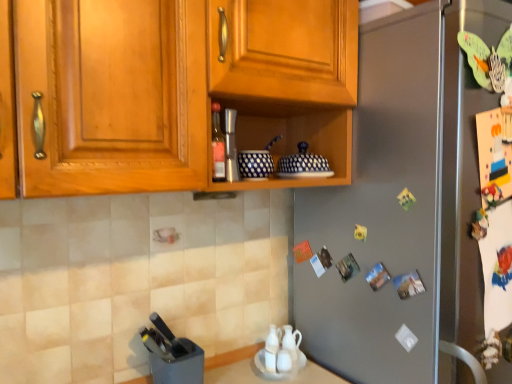
Question: From the image's perspective, relative to wooden cabinet at upper center, is black plastic knife block at lower left, acting as the first appliance starting from the bottom, above or below?

Choices:
 (A) above
 (B) below

Answer: (B)

Question: In terms of size, does black plastic knife block at lower left, acting as the first appliance starting from the bottom, appear bigger or smaller than wooden cabinet at upper center?

Choices:
 (A) small
 (B) big

Answer: (A)

Question: Based on their relative distances, which object is farther from the blue dotted ceramic bowls at center, which is the 2th appliance from top to bottom?

Choices:
 (A) brushed metal shaker at center, marked as the third appliance in a bottom-to-top arrangement
 (B) wooden cabinet at upper center
 (C) white glossy tea pot at lower center
 (D) black plastic knife block at lower left, marked as the 3th appliance in a top-to-bottom arrangement
 (E) matte glass bottle at center

Answer: (C)

Question: Based on their relative distances, which object is farther from the white glossy tea pot at lower center?

Choices:
 (A) satin silver refrigerator at center
 (B) black plastic knife block at lower left, marked as the 3th appliance in a top-to-bottom arrangement
 (C) matte glass bottle at center
 (D) wooden cabinet at upper center
 (E) brushed metal shaker at center, marked as the third appliance in a bottom-to-top arrangement

Answer: (D)